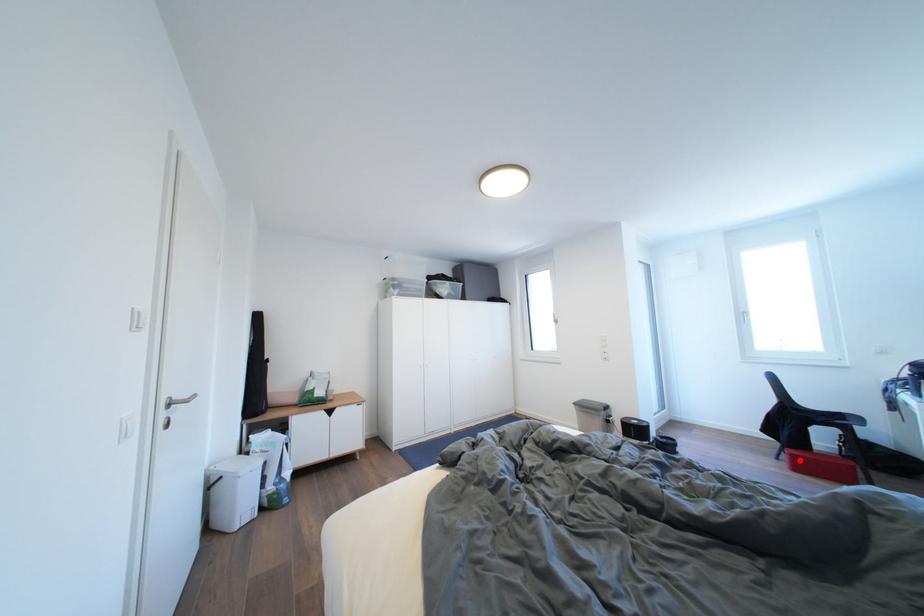
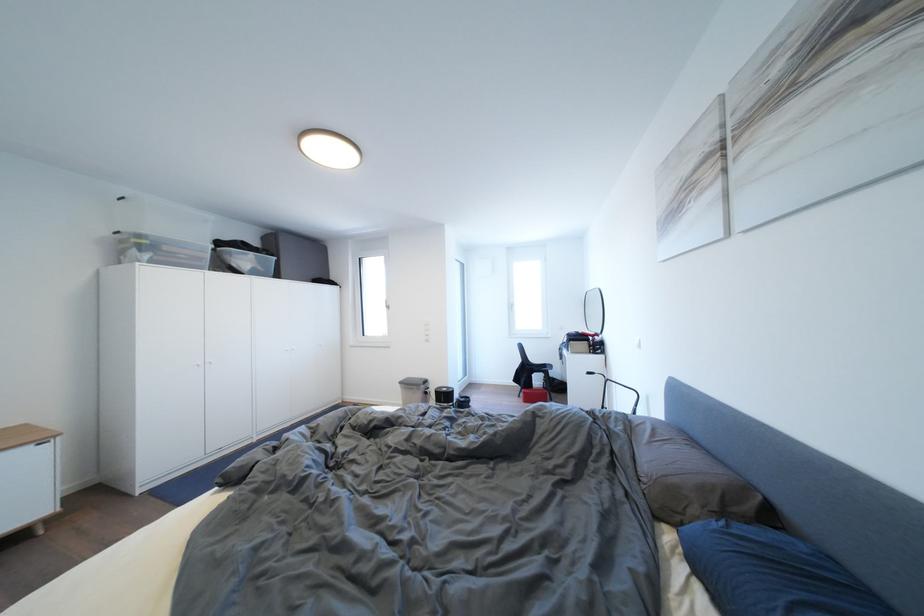
Find the pixel in the second image that matches the highlighted location in the first image.

(532, 398)